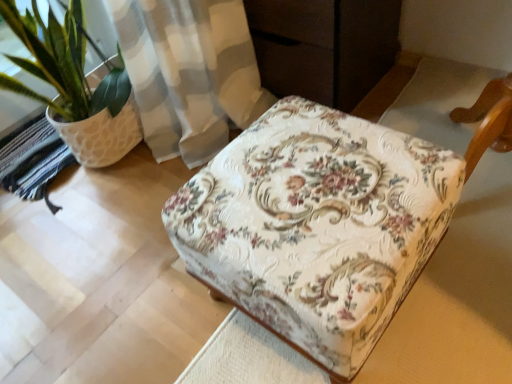
At what (x,y) coordinates should I click in order to perform the action: click on vacant area on top of floral fabric ottoman at center (from a real-world perspective). Please return your answer as a coordinate pair (x, y). This screenshot has width=512, height=384. Looking at the image, I should click on (323, 196).